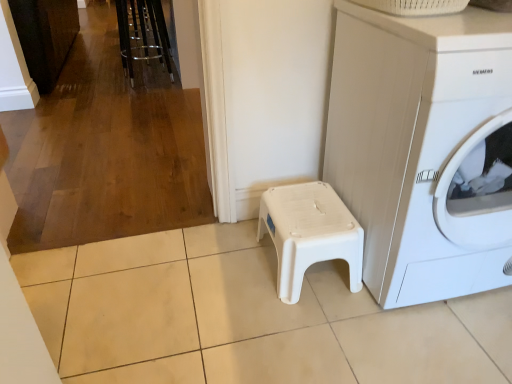
Question: From a real-world perspective, is white plastic washing machine at lower right on white plastic stool at center?

Choices:
 (A) yes
 (B) no

Answer: (A)

Question: Is white plastic washing machine at lower right positioned in front of white plastic stool at center?

Choices:
 (A) no
 (B) yes

Answer: (B)

Question: From the image's perspective, does white plastic washing machine at lower right appear higher than white plastic stool at center?

Choices:
 (A) yes
 (B) no

Answer: (A)

Question: From a real-world perspective, is white plastic washing machine at lower right located beneath white plastic stool at center?

Choices:
 (A) yes
 (B) no

Answer: (B)

Question: Considering the relative sizes of white plastic washing machine at lower right and white plastic stool at center in the image provided, is white plastic washing machine at lower right shorter than white plastic stool at center?

Choices:
 (A) yes
 (B) no

Answer: (B)

Question: Is point (381, 292) positioned closer to the camera than point (164, 59)?

Choices:
 (A) closer
 (B) farther

Answer: (A)

Question: Considering the positions of white plastic washing machine at lower right and metallic chrome bar stool at upper left in the image, is white plastic washing machine at lower right wider or thinner than metallic chrome bar stool at upper left?

Choices:
 (A) wide
 (B) thin

Answer: (A)

Question: In terms of size, does white plastic washing machine at lower right appear bigger or smaller than metallic chrome bar stool at upper left?

Choices:
 (A) big
 (B) small

Answer: (A)

Question: From a real-world perspective, is white plastic washing machine at lower right positioned above or below metallic chrome bar stool at upper left?

Choices:
 (A) below
 (B) above

Answer: (B)

Question: Is metallic chrome bar stool at upper left spatially inside white plastic stool at center, or outside of it?

Choices:
 (A) inside
 (B) outside

Answer: (B)

Question: From the image's perspective, is metallic chrome bar stool at upper left positioned above or below white plastic stool at center?

Choices:
 (A) below
 (B) above

Answer: (B)

Question: Relative to white plastic stool at center, is metallic chrome bar stool at upper left in front or behind?

Choices:
 (A) front
 (B) behind

Answer: (B)

Question: Visually, is metallic chrome bar stool at upper left positioned to the left or to the right of white plastic stool at center?

Choices:
 (A) left
 (B) right

Answer: (A)

Question: From the image's perspective, is white plastic washing machine at lower right positioned above or below white plastic stool at center?

Choices:
 (A) above
 (B) below

Answer: (A)

Question: Looking at their shapes, would you say white plastic washing machine at lower right is wider or thinner than white plastic stool at center?

Choices:
 (A) wide
 (B) thin

Answer: (A)